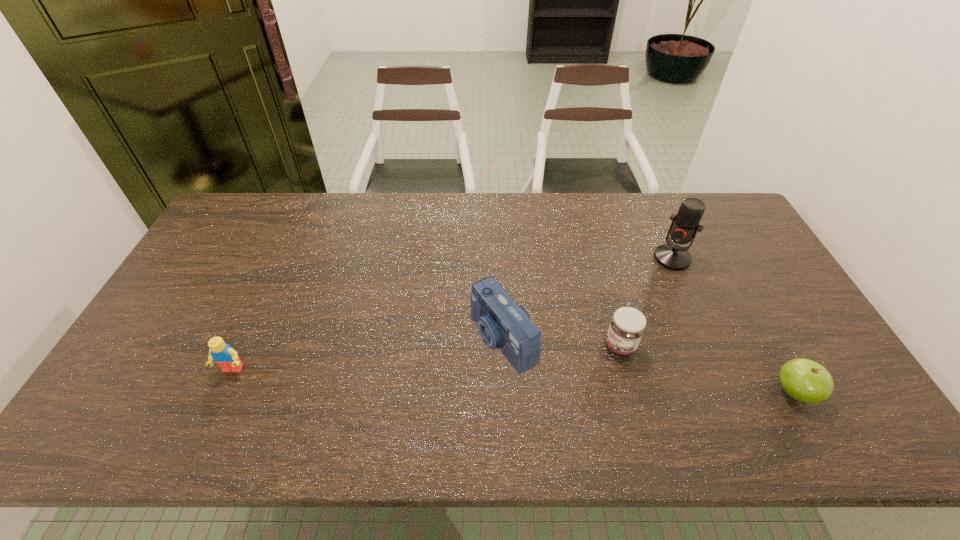
You are a GUI agent. You are given a task and a screenshot of the screen. Output one action in this format:
    pyautogui.click(x=<x>, y=<y>)
    Task: Click on the object at the right edge
    Image resolution: width=960 pixels, height=540 pixels.
    Given the screenshot: What is the action you would take?
    pyautogui.click(x=805, y=380)

What are the coordinates of `object that is at the near right corner` in the screenshot? It's located at (805, 380).

Find the location of `free space at the far edge`. free space at the far edge is located at coordinates (636, 197).

In the image, there is a desktop. Identify the location of vacant space at the near edge. (368, 382).

Identify the location of vacant space at the left edge of the desktop. This screenshot has width=960, height=540. (213, 272).

Image resolution: width=960 pixels, height=540 pixels. Identify the location of vacant space at the right edge of the desktop. (756, 254).

Where is `vacant space at the far left corner`? vacant space at the far left corner is located at coordinates (251, 206).

This screenshot has height=540, width=960. What are the coordinates of `free location at the far right corner` in the screenshot? It's located at (732, 231).

Identify the location of free space between the farthest object and the apple. Image resolution: width=960 pixels, height=540 pixels. (733, 325).

Locate an element on the screen. Image resolution: width=960 pixels, height=540 pixels. free space that is in between the fourth object from right to left and the tallest object is located at coordinates (588, 299).